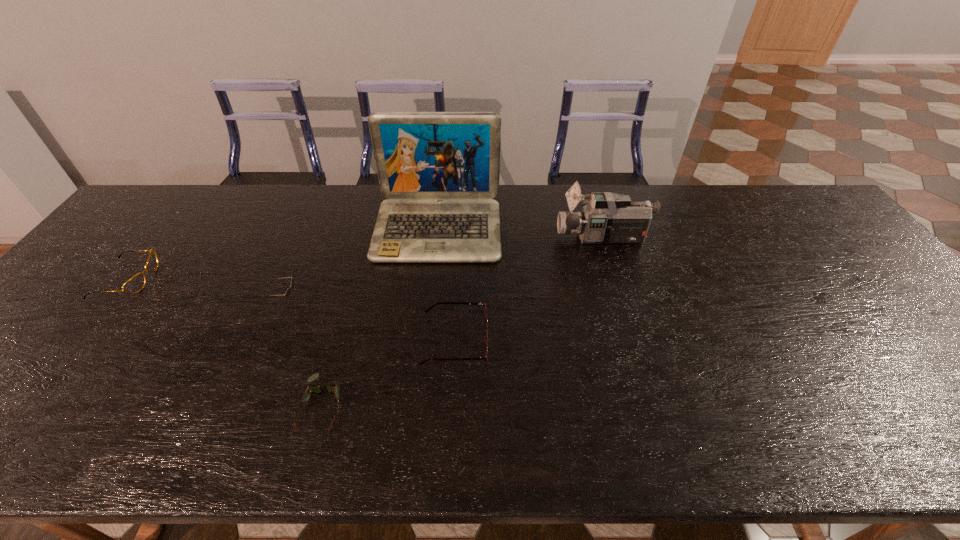
The width and height of the screenshot is (960, 540). I want to click on object that is at the left edge, so click(x=135, y=284).

Where is `vacant area at the far edge of the desktop`? The image size is (960, 540). vacant area at the far edge of the desktop is located at coordinates (x=564, y=191).

Image resolution: width=960 pixels, height=540 pixels. In the image, there is a desktop. What are the coordinates of `vacant space at the near edge` in the screenshot? It's located at coord(779,441).

This screenshot has width=960, height=540. I want to click on free space at the left edge of the desktop, so click(x=95, y=275).

I want to click on vacant space at the right edge of the desktop, so click(x=821, y=250).

Identify the location of blank area at the far right corner. The image size is (960, 540). (770, 208).

Identify the location of free area in between the fifth shortest object and the leftmost object. (365, 259).

You are a GUI agent. You are given a task and a screenshot of the screen. Output one action in this format:
    pyautogui.click(x=<x>, y=<y>)
    Task: Click on the vacant space that's between the shortest spectacles and the farthest spectacles
    The width and height of the screenshot is (960, 540).
    Given the screenshot: What is the action you would take?
    pyautogui.click(x=225, y=342)

Locate an element on the screen. Image resolution: width=960 pixels, height=540 pixels. free space between the tallest object and the sunglasses is located at coordinates (362, 266).

Image resolution: width=960 pixels, height=540 pixels. In order to click on free space between the shortest spectacles and the leftmost spectacles in this screenshot , I will do `click(225, 342)`.